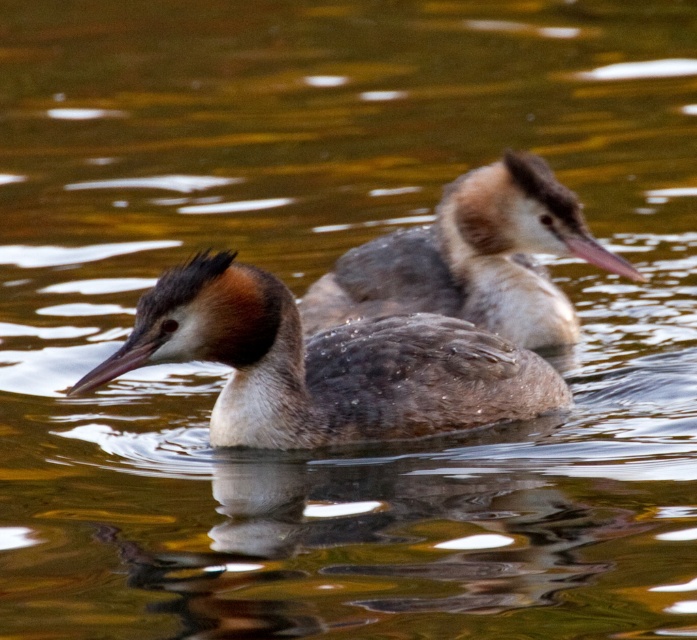
Question: Is brown matte duck at left to the right of brown matte duck at upper center from the viewer's perspective?

Choices:
 (A) no
 (B) yes

Answer: (A)

Question: Does brown matte duck at left lie in front of brown matte duck at upper center?

Choices:
 (A) no
 (B) yes

Answer: (B)

Question: Which point is farther from the camera taking this photo?

Choices:
 (A) (229, 253)
 (B) (459, 248)

Answer: (B)

Question: Which of the following is the farthest from the observer?

Choices:
 (A) brown matte duck at left
 (B) brown matte duck at upper center

Answer: (B)

Question: Where is brown matte duck at left located in relation to brown matte duck at upper center in the image?

Choices:
 (A) left
 (B) right

Answer: (A)